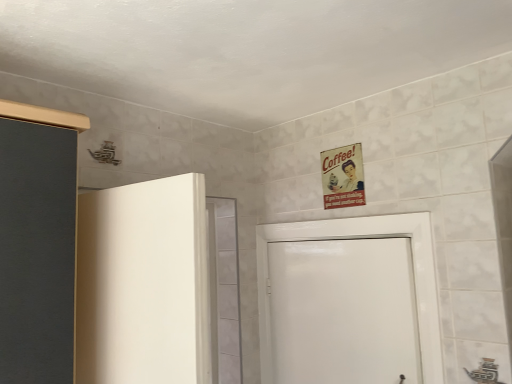
Question: Does white glossy door at center have a smaller size compared to metallic vintage poster at upper center?

Choices:
 (A) no
 (B) yes

Answer: (A)

Question: From the image's perspective, is white glossy door at center over metallic vintage poster at upper center?

Choices:
 (A) no
 (B) yes

Answer: (A)

Question: Is white glossy door at center placed right next to metallic vintage poster at upper center?

Choices:
 (A) yes
 (B) no

Answer: (B)

Question: Is white glossy door at center surrounding metallic vintage poster at upper center?

Choices:
 (A) yes
 (B) no

Answer: (B)

Question: Can you confirm if white glossy door at center is taller than metallic vintage poster at upper center?

Choices:
 (A) yes
 (B) no

Answer: (A)

Question: Is white glossy door at center to the left of metallic vintage poster at upper center from the viewer's perspective?

Choices:
 (A) yes
 (B) no

Answer: (A)

Question: Can you confirm if metallic vintage poster at upper center is positioned to the left of white glossy door at center?

Choices:
 (A) no
 (B) yes

Answer: (A)

Question: From the image's perspective, does metallic vintage poster at upper center appear lower than white glossy door at center?

Choices:
 (A) no
 (B) yes

Answer: (A)

Question: Is metallic vintage poster at upper center far away from white glossy door at center?

Choices:
 (A) yes
 (B) no

Answer: (B)

Question: Does metallic vintage poster at upper center have a smaller size compared to white glossy door at center?

Choices:
 (A) yes
 (B) no

Answer: (A)

Question: Considering the relative sizes of metallic vintage poster at upper center and white glossy door at center in the image provided, is metallic vintage poster at upper center shorter than white glossy door at center?

Choices:
 (A) yes
 (B) no

Answer: (A)

Question: Is white glossy door at center at the back of metallic vintage poster at upper center?

Choices:
 (A) no
 (B) yes

Answer: (A)

Question: Is white glossy door at center to the left or to the right of metallic vintage poster at upper center in the image?

Choices:
 (A) left
 (B) right

Answer: (A)